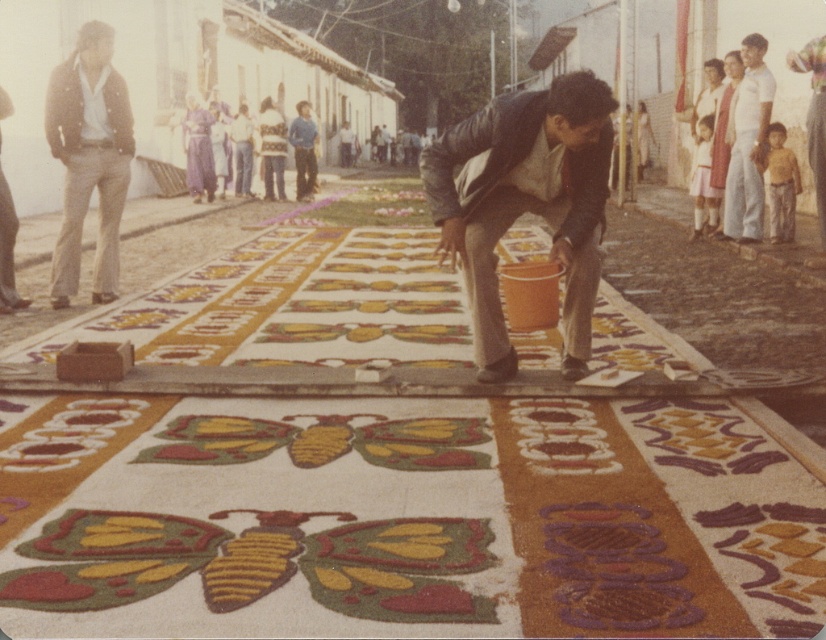
You are a photographer positioned behind the man creating the floral carpet. You want to take a photo that includes both the matte black jacket at center and the light brown denim pants at left. Which object should you focus on first to ensure both are in the frame?

You should focus on the matte black jacket at center first because it is in front of the light brown denim pants at left, so by focusing on the front object, both will be in the frame.

You are a photographer trying to capture the man creating the multicolored sand art at center and the light brown denim pants at left in the same frame. Based on their heights, which object should you focus on first to ensure both are in the shot?

The multicolored sand art at center is shorter than the light brown denim pants at left, so you should focus on the light brown denim pants at left first to ensure both are in the shot.

You are standing at the point with coordinates point (53, 156) and want to walk to the point with coordinates point (582, 128). Which direction should you face to move towards your destination?

You should face north because point (582, 128) is in front of point (53, 156), indicating it is north of your current position.